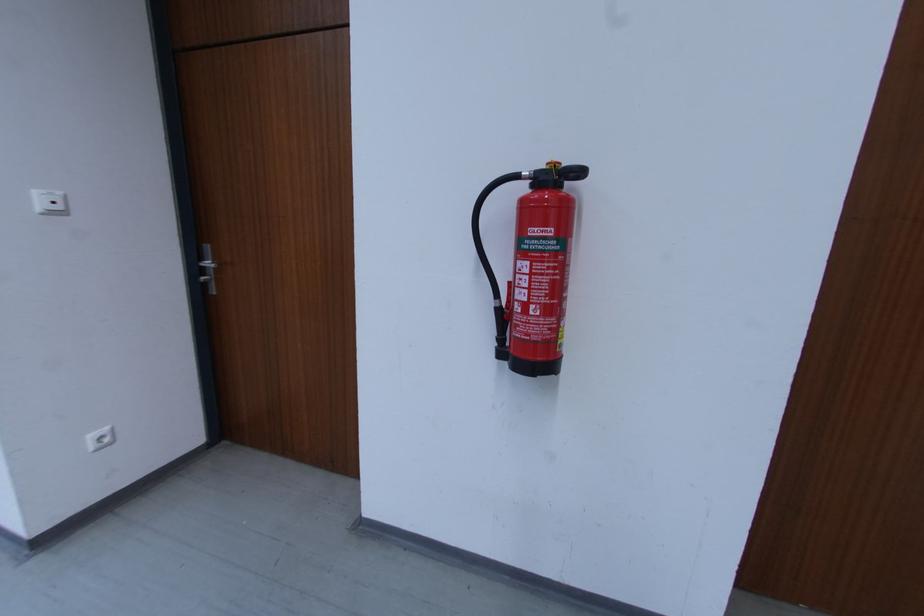
The image size is (924, 616). In order to click on light switch button in this screenshot , I will do `click(50, 201)`.